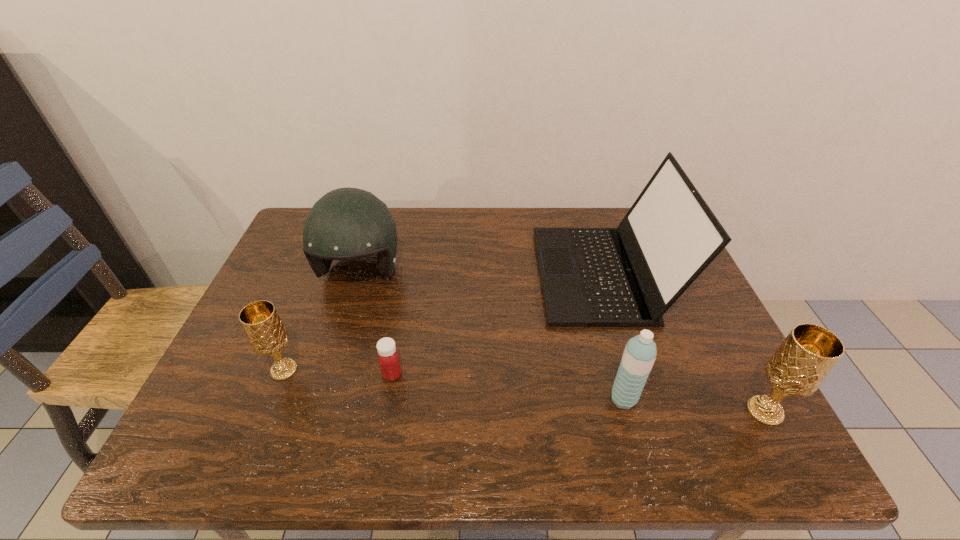
You are a GUI agent. You are given a task and a screenshot of the screen. Output one action in this format:
    pyautogui.click(x=<x>, y=<y>)
    Task: Click on the free point between the nearer chalice and the left chalice
    The height and width of the screenshot is (540, 960).
    Given the screenshot: What is the action you would take?
    pyautogui.click(x=524, y=390)

You are a GUI agent. You are given a task and a screenshot of the screen. Output one action in this format:
    pyautogui.click(x=<x>, y=<y>)
    Task: Click on the free space between the shortest object and the laptop
    This screenshot has width=960, height=540.
    Given the screenshot: What is the action you would take?
    pyautogui.click(x=497, y=324)

Locate an element on the screen. Image resolution: width=960 pixels, height=540 pixels. vacant region between the laptop and the rightmost object is located at coordinates (684, 342).

This screenshot has height=540, width=960. In order to click on object that is the second closest one to the water bottle in this screenshot , I will do `click(802, 362)`.

Find the location of a particular element. the fourth closest object to the medicine is located at coordinates (639, 355).

Where is `vacant space that satisfies the following two spatial constraints: 1. on the surface of the laptop; 2. on the front side of the farther chalice`? The height and width of the screenshot is (540, 960). vacant space that satisfies the following two spatial constraints: 1. on the surface of the laptop; 2. on the front side of the farther chalice is located at coordinates (633, 370).

Locate an element on the screen. The width and height of the screenshot is (960, 540). free space that satisfies the following two spatial constraints: 1. at the face opening of the football helmet; 2. on the right side of the rightmost object is located at coordinates (318, 411).